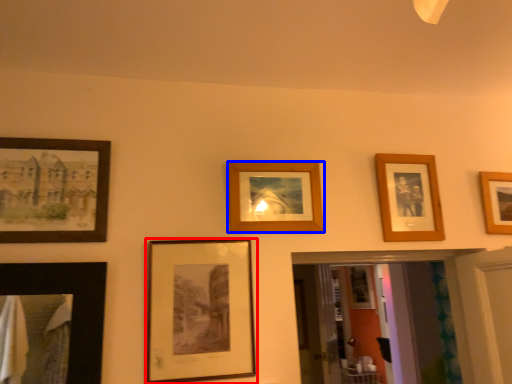
Question: Which of the following is the closest to the observer, picture frame (highlighted by a red box) or picture frame (highlighted by a blue box)?

Choices:
 (A) picture frame
 (B) picture frame

Answer: (A)